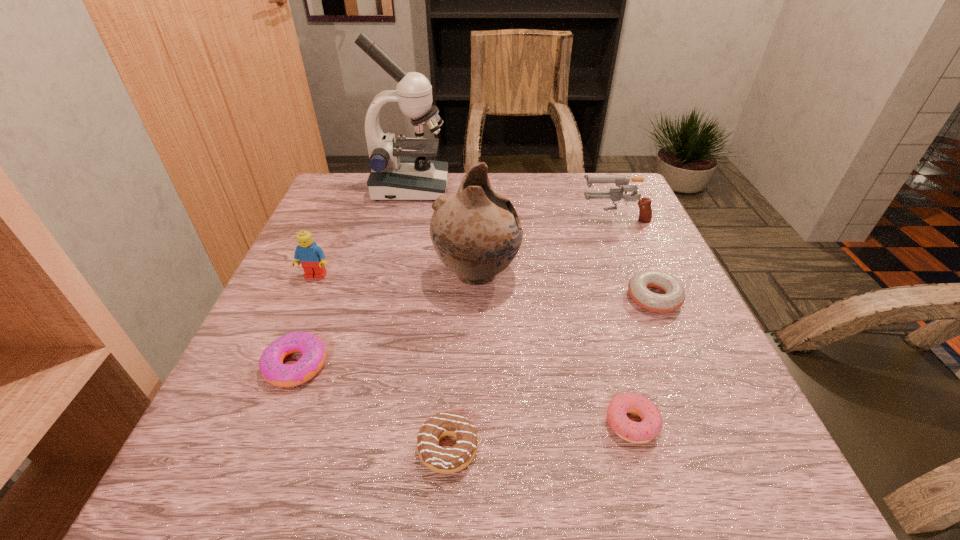
In order to click on vacant space that satisfies the following two spatial constraints: 1. at the barrel end of the farthest doughnut; 2. on the left side of the seventh nearest object in this screenshot , I will do `click(647, 298)`.

The width and height of the screenshot is (960, 540). I want to click on vacant space that satisfies the following two spatial constraints: 1. from the spout of the pottery; 2. on the face of the Lego, so click(x=477, y=276).

Find the location of a particular element. vacant area that satisfies the following two spatial constraints: 1. on the face of the Lego; 2. on the left side of the farthest doughnut is located at coordinates (306, 298).

Image resolution: width=960 pixels, height=540 pixels. I want to click on free region that satisfies the following two spatial constraints: 1. at the barrel end of the second farthest object; 2. on the right side of the rightmost doughnut, so click(647, 298).

Identify the location of free space that satisfies the following two spatial constraints: 1. from the spout of the farthest doughnut; 2. on the left side of the pottery. The image size is (960, 540). (476, 298).